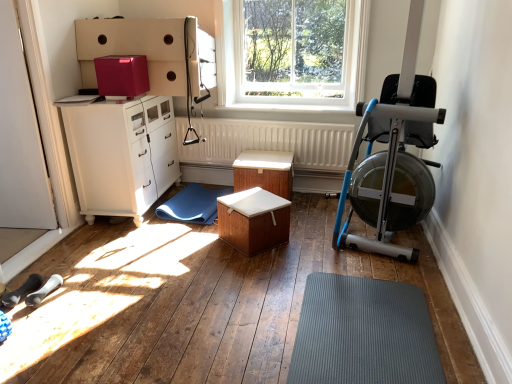
Where is `vacant area that lies between wooden box at center, the 2th table positioned from the back, and silver metallic rowing machine at right`? vacant area that lies between wooden box at center, the 2th table positioned from the back, and silver metallic rowing machine at right is located at coordinates (313, 240).